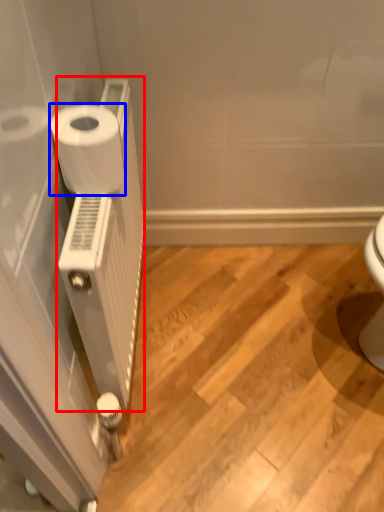
Question: Which object appears farthest to the camera in this image, radiator (highlighted by a red box) or toilet paper (highlighted by a blue box)?

Choices:
 (A) radiator
 (B) toilet paper

Answer: (B)